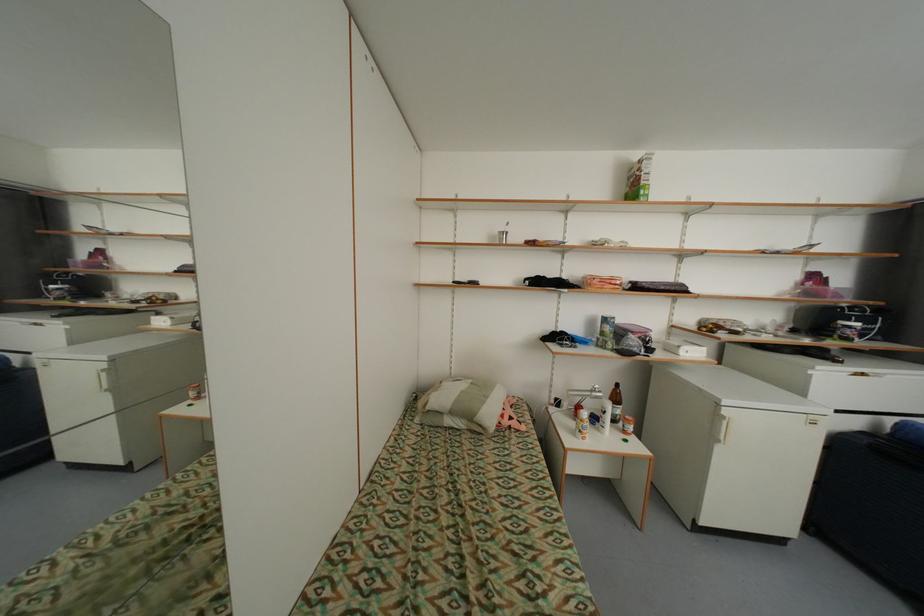
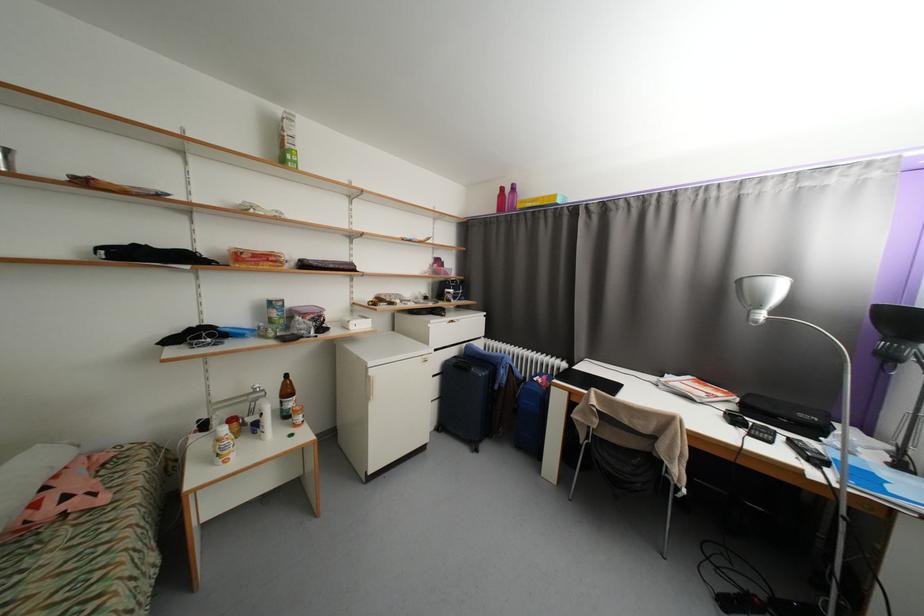
Find the pixel in the second image that matches point 849,435 in the first image.

(453, 362)